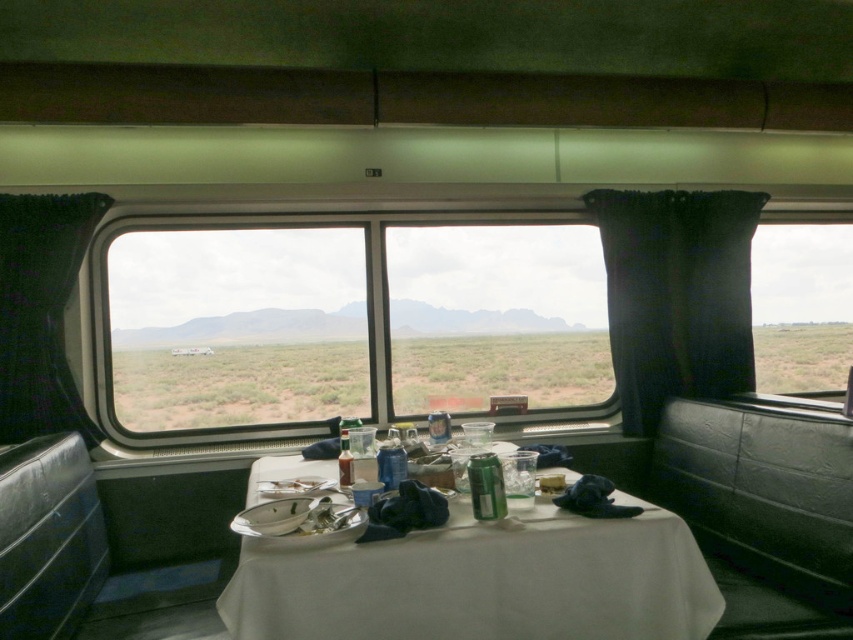
Question: Which object appears farthest from the camera in this image?

Choices:
 (A) green fabric curtain at left
 (B) clear glass window at center
 (C) black fabric curtain at right
 (D) white cloth table at center

Answer: (C)

Question: Can you confirm if white cloth table at center is positioned to the left of black fabric curtain at right?

Choices:
 (A) no
 (B) yes

Answer: (B)

Question: Among these points, which one is nearest to the camera?

Choices:
 (A) (399, 333)
 (B) (431, 611)

Answer: (B)

Question: Does white cloth table at center appear under green fabric curtain at left?

Choices:
 (A) no
 (B) yes

Answer: (B)

Question: Which point is farther to the camera?

Choices:
 (A) (648, 524)
 (B) (306, 320)
 (C) (36, 397)

Answer: (B)

Question: Can you confirm if white cloth table at center is thinner than green fabric curtain at left?

Choices:
 (A) no
 (B) yes

Answer: (A)